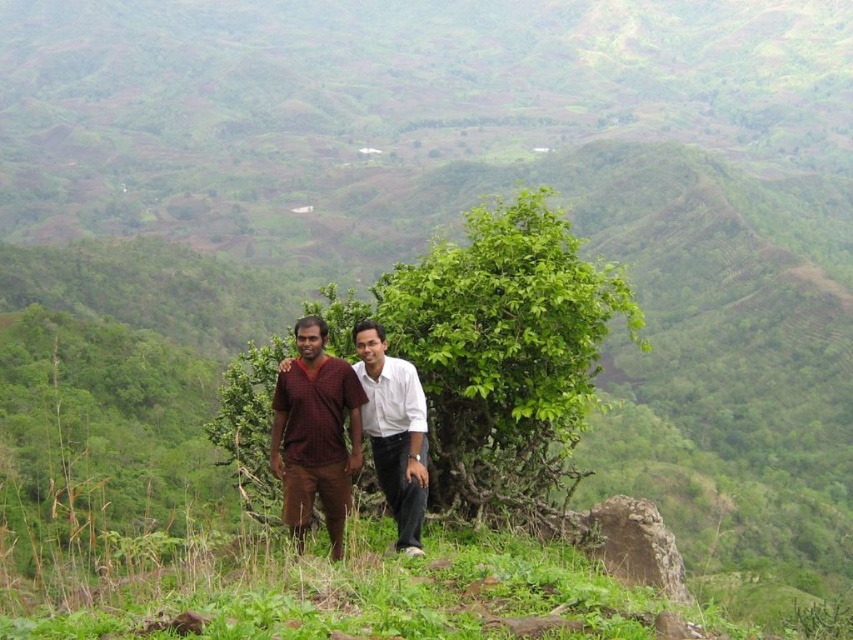
Question: Can you confirm if maroon fabric shirt at center is thinner than white smooth shirt at center?

Choices:
 (A) yes
 (B) no

Answer: (B)

Question: Can you confirm if maroon fabric shirt at center is positioned below white smooth shirt at center?

Choices:
 (A) no
 (B) yes

Answer: (A)

Question: Which object is farther from the camera taking this photo?

Choices:
 (A) maroon fabric shirt at center
 (B) white smooth shirt at center

Answer: (B)

Question: Can you confirm if maroon fabric shirt at center is positioned to the left of white smooth shirt at center?

Choices:
 (A) no
 (B) yes

Answer: (A)